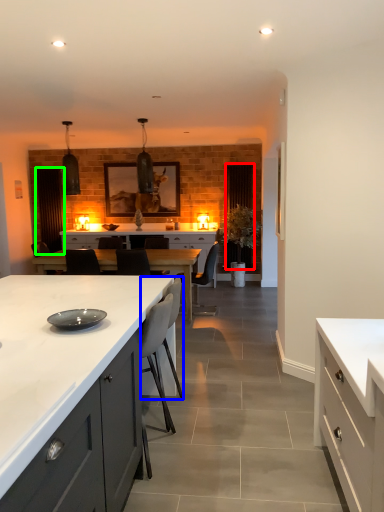
Question: Based on their relative distances, which object is nearer to glass door (highlighted by a red box)? Choose from armchair (highlighted by a blue box) and glass door (highlighted by a green box).

Choices:
 (A) armchair
 (B) glass door

Answer: (B)